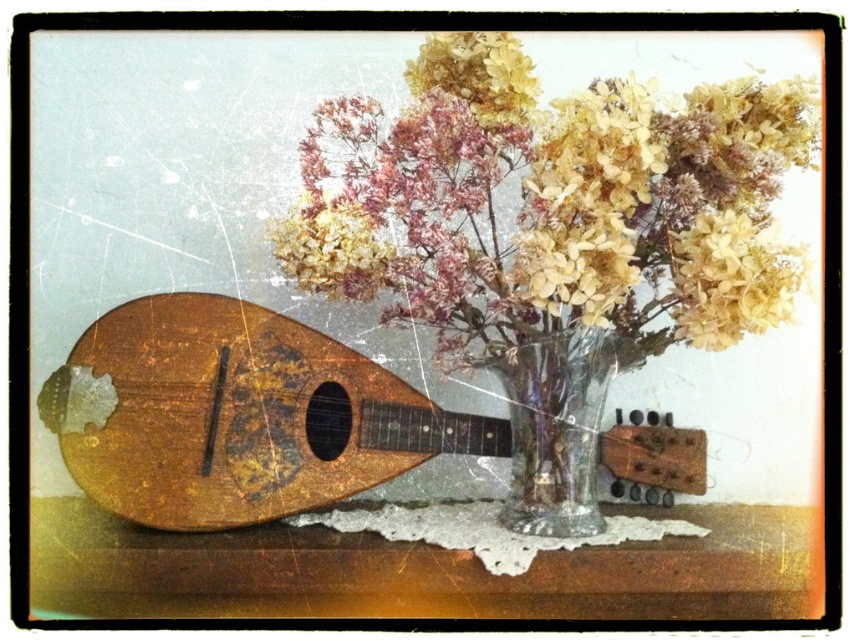
Who is positioned more to the left, translucent glass vase at center or transparent glass vase at center?

translucent glass vase at center is more to the left.

Between translucent glass vase at center and transparent glass vase at center, which one has less height?

transparent glass vase at center

Does point (431, 316) come closer to viewer compared to point (587, 422)?

Yes, it is.

Identify the location of translucent glass vase at center. This screenshot has width=856, height=640. (553, 234).

Can you confirm if wooden mandolin at left is taller than transparent glass vase at center?

Correct, wooden mandolin at left is much taller as transparent glass vase at center.

The image size is (856, 640). In order to click on wooden mandolin at left in this screenshot , I will do `click(236, 416)`.

Identify the location of wooden mandolin at left. The height and width of the screenshot is (640, 856). (236, 416).

Can you confirm if translucent glass vase at center is wider than wooden mandolin at left?

In fact, translucent glass vase at center might be narrower than wooden mandolin at left.

Is point (502, 305) farther from camera compared to point (241, 353)?

No, it is not.

Where is `translucent glass vase at center`? This screenshot has height=640, width=856. translucent glass vase at center is located at coordinates (553, 234).